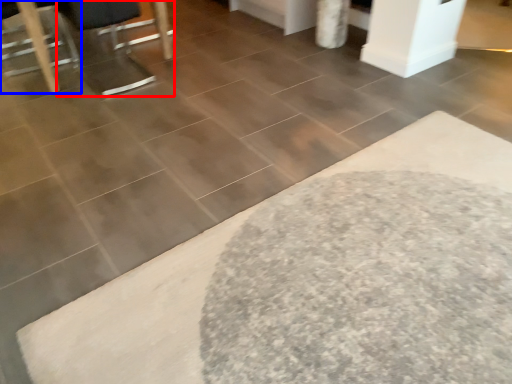
Question: Which object appears farthest to the camera in this image, swivel chair (highlighted by a red box) or furniture (highlighted by a blue box)?

Choices:
 (A) swivel chair
 (B) furniture

Answer: (B)